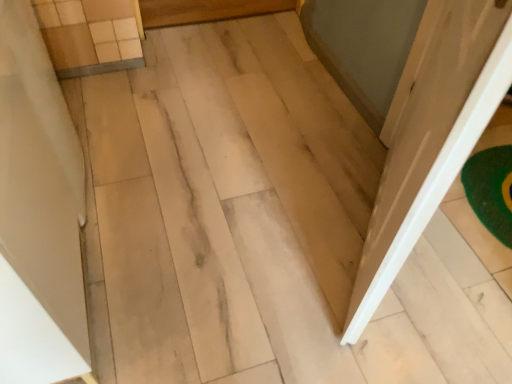
At what (x,y) coordinates should I click in order to perform the action: click on space that is in front of white wood door at right. Please return your answer as a coordinate pair (x, y). This screenshot has width=512, height=384. Looking at the image, I should click on (370, 328).